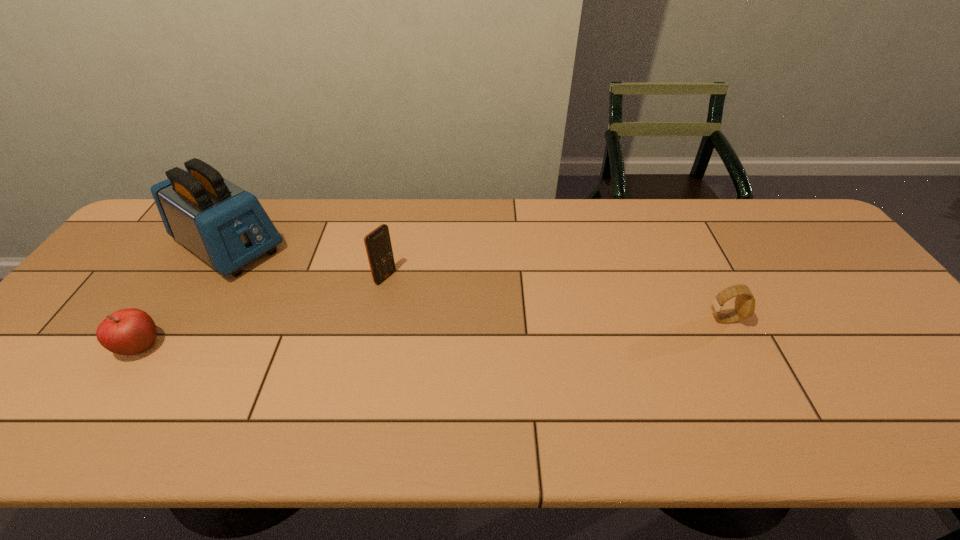
What are the coordinates of `vacant space located 0.170m on the screen of the cellular telephone` in the screenshot? It's located at (441, 310).

The width and height of the screenshot is (960, 540). I want to click on vacant space located on the screen of the cellular telephone, so click(446, 313).

I want to click on free space located 0.380m on the screen of the cellular telephone, so click(509, 348).

Where is `object situated at the far edge`? This screenshot has height=540, width=960. object situated at the far edge is located at coordinates [x=226, y=226].

Find the location of a particular element. The height and width of the screenshot is (540, 960). object located at the left edge is located at coordinates (226, 226).

At what (x,y) coordinates should I click in order to perform the action: click on object positioned at the far left corner. Please return your answer as a coordinate pair (x, y). The width and height of the screenshot is (960, 540). Looking at the image, I should click on (226, 226).

Find the location of `free location at the far edge of the desktop`. free location at the far edge of the desktop is located at coordinates (283, 215).

Find the location of a particular element. vacant space at the near edge is located at coordinates (418, 379).

Locate an element on the screen. The width and height of the screenshot is (960, 540). vacant space at the left edge of the desktop is located at coordinates (132, 271).

In the image, there is a desktop. Where is `free space at the right edge`? free space at the right edge is located at coordinates (871, 294).